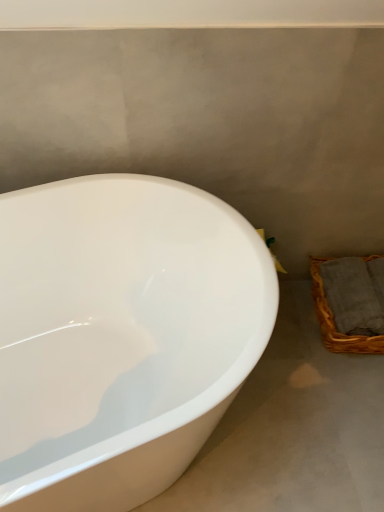
Question: Is the depth of woven brown basket at lower right greater than that of white glossy bathtub at left?

Choices:
 (A) no
 (B) yes

Answer: (B)

Question: Is woven brown basket at lower right positioned beyond the bounds of white glossy bathtub at left?

Choices:
 (A) no
 (B) yes

Answer: (B)

Question: From the image's perspective, is woven brown basket at lower right over white glossy bathtub at left?

Choices:
 (A) no
 (B) yes

Answer: (B)

Question: Can you confirm if woven brown basket at lower right is thinner than white glossy bathtub at left?

Choices:
 (A) yes
 (B) no

Answer: (A)

Question: Can you confirm if woven brown basket at lower right is wider than white glossy bathtub at left?

Choices:
 (A) yes
 (B) no

Answer: (B)

Question: Could you tell me if woven brown basket at lower right is turned towards white glossy bathtub at left?

Choices:
 (A) yes
 (B) no

Answer: (A)

Question: Is white glossy bathtub at left facing towards woven brown basket at lower right?

Choices:
 (A) yes
 (B) no

Answer: (B)

Question: Is white glossy bathtub at left positioned beyond the bounds of woven brown basket at lower right?

Choices:
 (A) no
 (B) yes

Answer: (B)

Question: Does white glossy bathtub at left have a greater height compared to woven brown basket at lower right?

Choices:
 (A) no
 (B) yes

Answer: (B)

Question: Is the position of white glossy bathtub at left less distant than that of woven brown basket at lower right?

Choices:
 (A) no
 (B) yes

Answer: (B)

Question: Does white glossy bathtub at left have a lesser width compared to woven brown basket at lower right?

Choices:
 (A) no
 (B) yes

Answer: (A)

Question: From a real-world perspective, is white glossy bathtub at left positioned under woven brown basket at lower right based on gravity?

Choices:
 (A) no
 (B) yes

Answer: (A)

Question: Which is correct: white glossy bathtub at left is inside woven brown basket at lower right, or outside of it?

Choices:
 (A) outside
 (B) inside

Answer: (A)